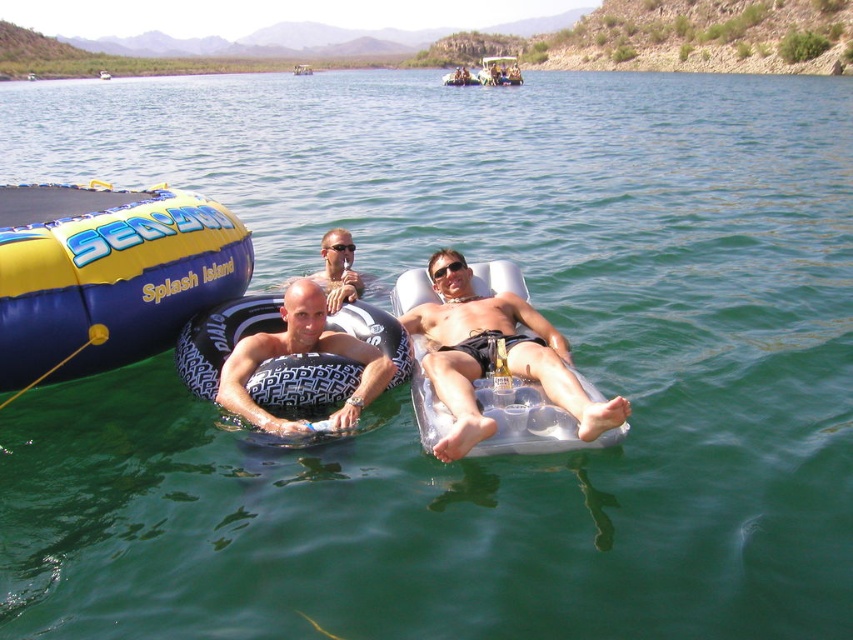
Question: Considering the real-world distances, which object is farthest from the smooth black ring at center?

Choices:
 (A) yellow rubber boat at center
 (B) black plastic goggles at center
 (C) matte black sunglasses at center
 (D) matte white lounge chair at center

Answer: (A)

Question: Which point is farther from the camera taking this photo?

Choices:
 (A) (512, 58)
 (B) (544, 436)
 (C) (337, 252)
 (D) (306, 74)

Answer: (A)

Question: Can you confirm if smooth black ring at center is positioned above blue inflatable raft at center?

Choices:
 (A) no
 (B) yes

Answer: (A)

Question: Is matte black sunglasses at center positioned behind metallic silver raft at center?

Choices:
 (A) yes
 (B) no

Answer: (B)

Question: Among these objects, which one is farthest from the camera?

Choices:
 (A) blue inflatable raft at center
 (B) smooth black ring at center
 (C) black plastic goggles at center
 (D) matte white lounge chair at center

Answer: (A)

Question: Does yellow/inflatable boat at left come behind metallic silver raft at center?

Choices:
 (A) yes
 (B) no

Answer: (B)